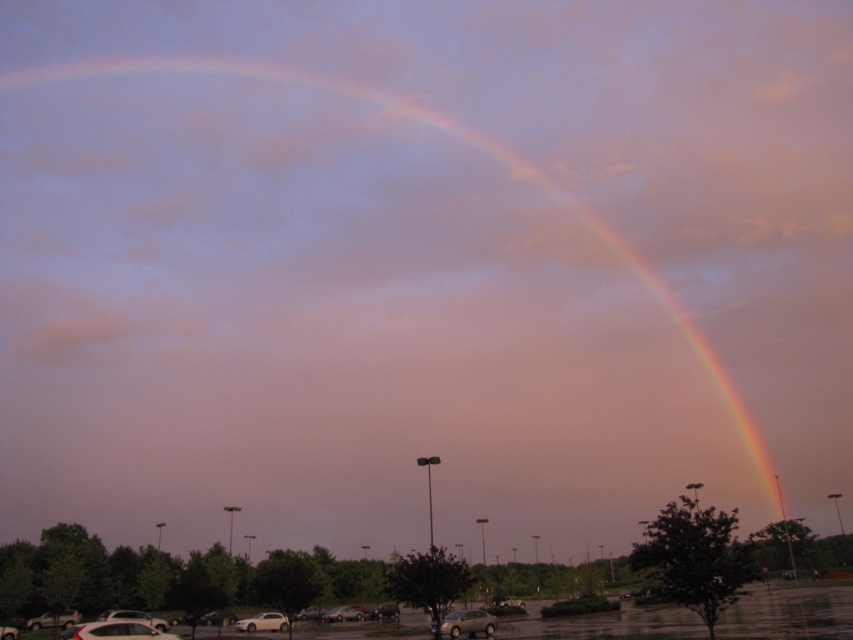
You are a delivery person trying to park your van between the silver metallic car at lower left and the white matte car at lower left. The van is 15 feet long. Can you fit it in the space between them?

The distance between the silver metallic car at lower left and the white matte car at lower left is 9.82 feet, which is shorter than the van length of 15 feet. Therefore, the van cannot fit in the space between them.

You are standing in the parking lot and want to park your car between the silver metallic car at lower left and the white matte car at lower left. Which car should you place your car next to if you want to park closer to the shorter vehicle?

The silver metallic car at lower left is not as tall as the white matte car at lower left, so it is shorter. Therefore, you should park your car next to the silver metallic car at lower left to be closer to the shorter vehicle.